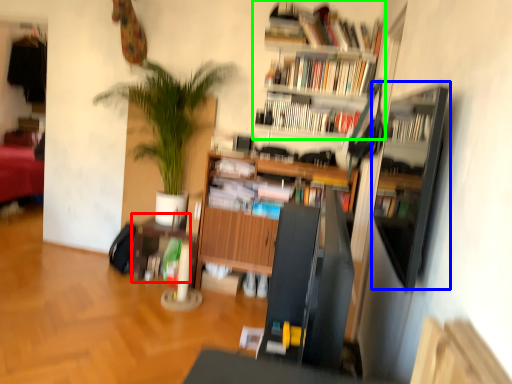
Question: Which is nearer to the table (highlighted by a red box)? shelf (highlighted by a blue box) or bookcase (highlighted by a green box).

Choices:
 (A) shelf
 (B) bookcase

Answer: (B)